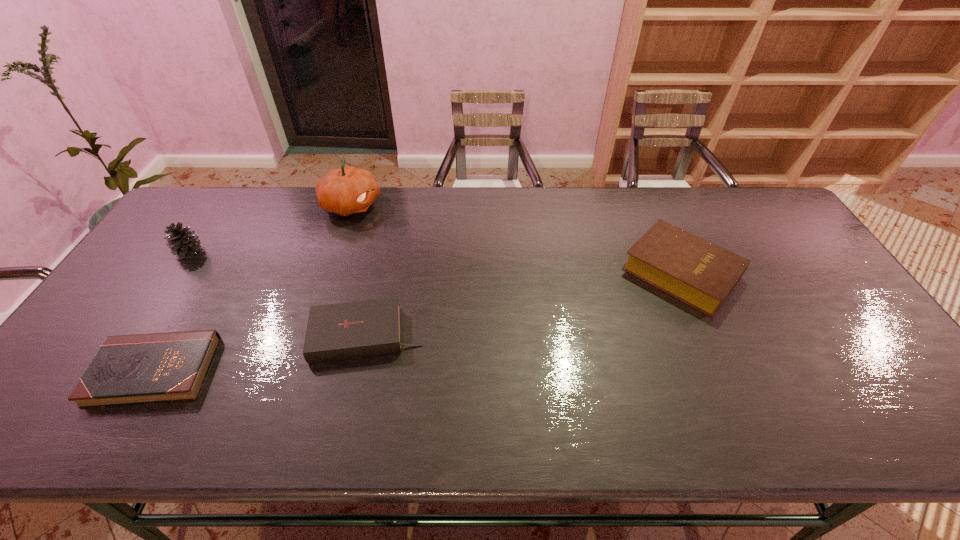
Where is `vacant area in the image that satisfies the following two spatial constraints: 1. on the front side of the third shortest object; 2. on the left side of the pinecone`? vacant area in the image that satisfies the following two spatial constraints: 1. on the front side of the third shortest object; 2. on the left side of the pinecone is located at coordinates (177, 272).